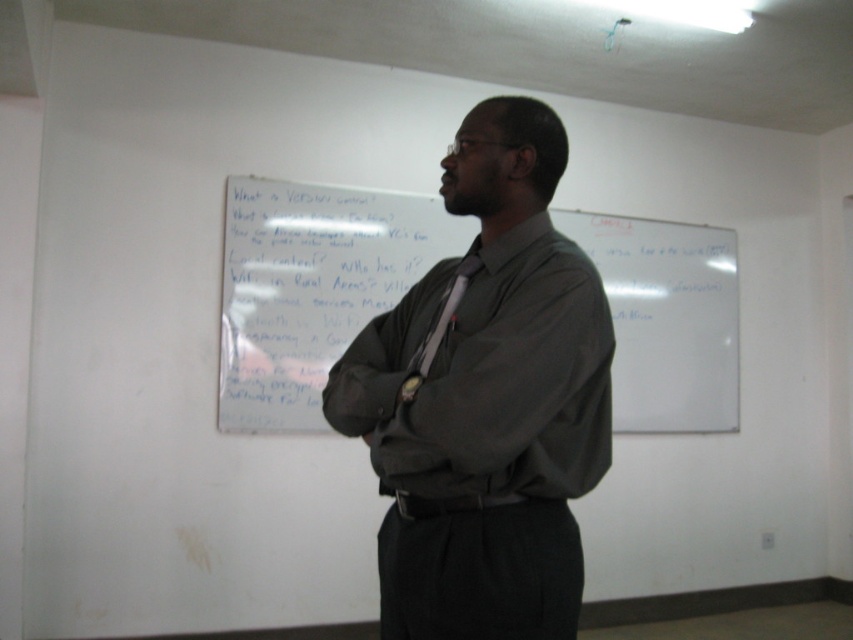
Question: Does whiteboard at center appear on the right side of matte black tie at center?

Choices:
 (A) yes
 (B) no

Answer: (A)

Question: Among these objects, which one is farthest from the camera?

Choices:
 (A) whiteboard at center
 (B) dark gray shirt at center
 (C) matte black tie at center

Answer: (A)

Question: Which object is the farthest from the matte gray shirt at center?

Choices:
 (A) matte black tie at center
 (B) whiteboard at center
 (C) dark gray shirt at center

Answer: (B)

Question: Which point appears farthest from the camera in this image?

Choices:
 (A) (253, 228)
 (B) (419, 360)
 (C) (381, 372)

Answer: (A)

Question: Is the position of dark gray shirt at center less distant than that of matte black tie at center?

Choices:
 (A) no
 (B) yes

Answer: (B)

Question: Is whiteboard at center to the left of matte black tie at center from the viewer's perspective?

Choices:
 (A) yes
 (B) no

Answer: (B)